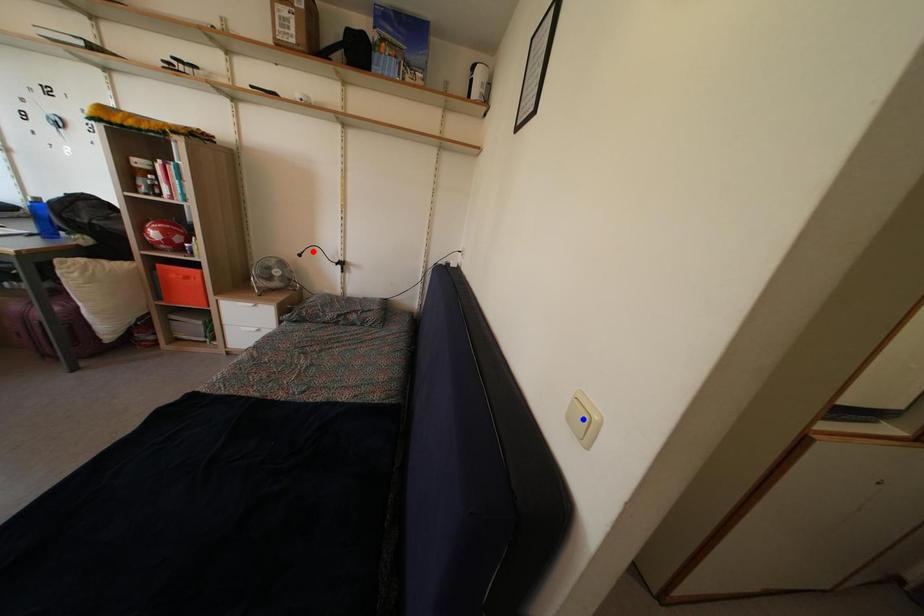
Question: Two points are marked on the image. Which point is closer to the camera?

Choices:
 (A) Blue point is closer.
 (B) Red point is closer.

Answer: (A)